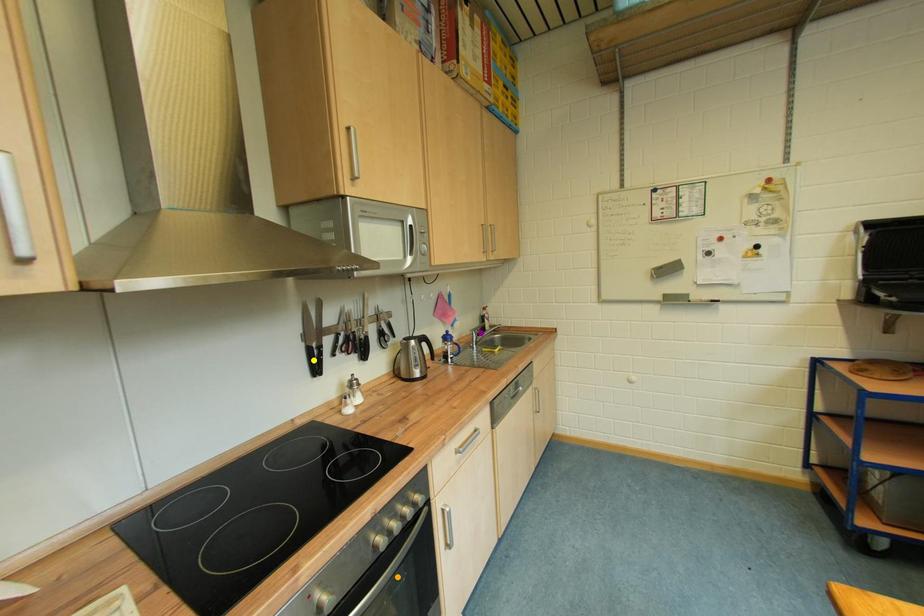
Order these from farthest to nearest:
1. yellow point
2. orange point
3. purple point

purple point
yellow point
orange point